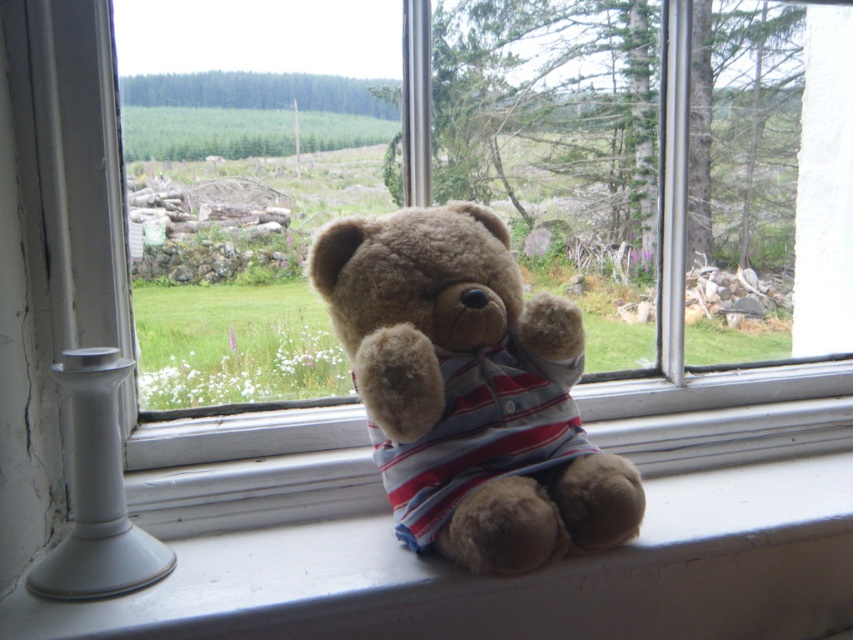
Question: Does white smooth window sill at lower center have a larger size compared to fuzzy brown bear at center?

Choices:
 (A) yes
 (B) no

Answer: (A)

Question: Which of the following is the farthest from the observer?

Choices:
 (A) fuzzy brown bear at center
 (B) white smooth window sill at lower center

Answer: (A)

Question: From the image, what is the correct spatial relationship of white smooth window sill at lower center in relation to fuzzy brown bear at center?

Choices:
 (A) right
 (B) left

Answer: (A)

Question: Can you confirm if white smooth window sill at lower center is positioned below fuzzy brown bear at center?

Choices:
 (A) yes
 (B) no

Answer: (A)

Question: Which point is farther from the camera taking this photo?

Choices:
 (A) (469, 280)
 (B) (779, 541)

Answer: (B)